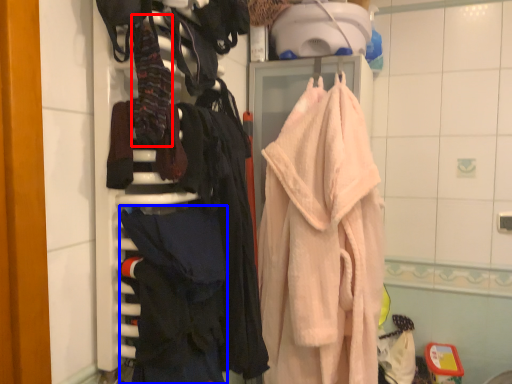
Question: Which of the following is the farthest to the observer, clothing (highlighted by a red box) or clothing (highlighted by a blue box)?

Choices:
 (A) clothing
 (B) clothing

Answer: (B)